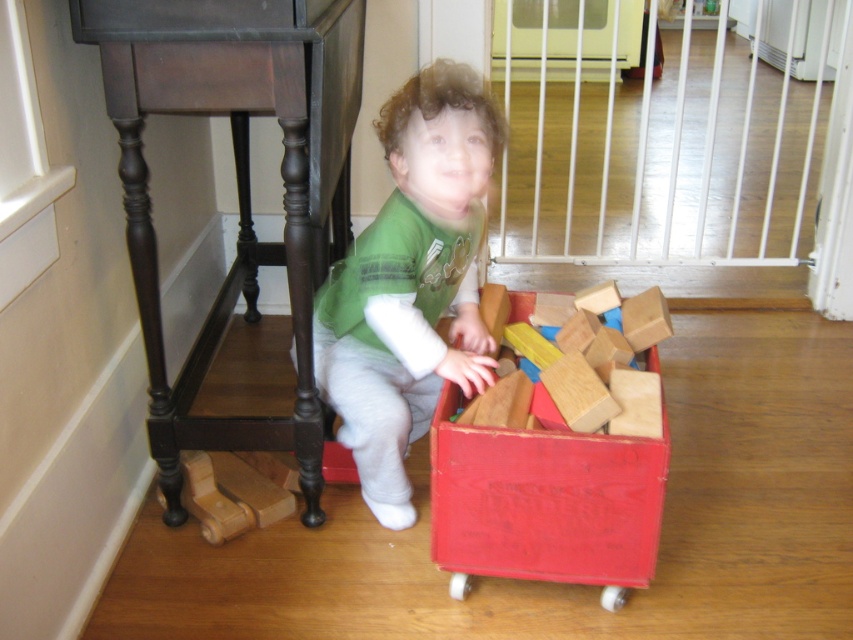
Question: Among these objects, which one is farthest from the camera?

Choices:
 (A) wooden blocks at center
 (B) green matte shirt at center

Answer: (B)

Question: Which point is closer to the camera?

Choices:
 (A) 416,412
 (B) 508,432

Answer: (B)

Question: From the image, what is the correct spatial relationship of green matte shirt at center in relation to wooden blocks at center?

Choices:
 (A) left
 (B) right

Answer: (A)

Question: Is green matte shirt at center to the right of wooden blocks at center from the viewer's perspective?

Choices:
 (A) yes
 (B) no

Answer: (B)

Question: Is green matte shirt at center further to the viewer compared to wooden blocks at center?

Choices:
 (A) yes
 (B) no

Answer: (A)

Question: Which point is closer to the camera?

Choices:
 (A) wooden blocks at center
 (B) green matte shirt at center

Answer: (A)